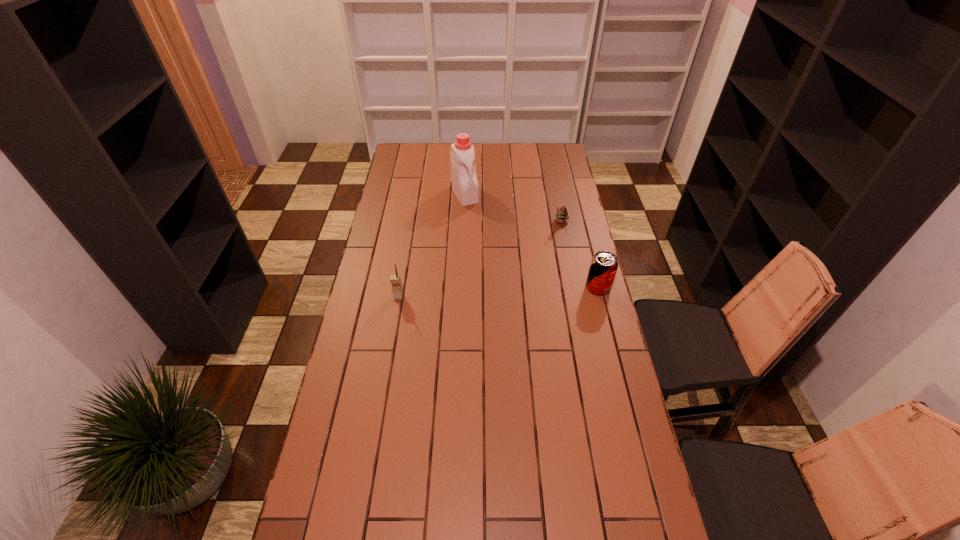
Where is `vacant space on the desktop that is between the leftmost object and the soda can and is positioned on the handle side of the third object from right to left`? This screenshot has width=960, height=540. vacant space on the desktop that is between the leftmost object and the soda can and is positioned on the handle side of the third object from right to left is located at coordinates (518, 291).

Where is `free space on the desktop that is between the cellular telephone and the rightmost object and is positioned on the face of the third nearest object`? free space on the desktop that is between the cellular telephone and the rightmost object and is positioned on the face of the third nearest object is located at coordinates (520, 291).